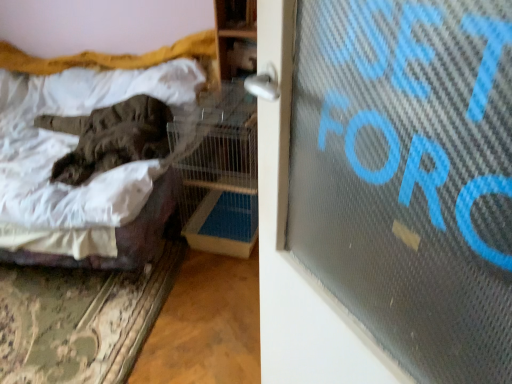
Image resolution: width=512 pixels, height=384 pixels. What do you see at coordinates (110, 137) in the screenshot?
I see `dark gray fur cat at left` at bounding box center [110, 137].

Locate an element on the screen. dark gray fur cat at left is located at coordinates (110, 137).

What is the approximate height of velvet brown blanket at left?

The height of velvet brown blanket at left is 24.88 inches.

What do you see at coordinates (118, 58) in the screenshot? The image size is (512, 384). I see `velvet brown blanket at left` at bounding box center [118, 58].

Image resolution: width=512 pixels, height=384 pixels. I want to click on velvet brown blanket at left, so click(x=118, y=58).

In order to face velvet brown blanket at left, should I rotate leftwards or rightwards?

To face it directly, rotate left by 27.102 degrees.

The height and width of the screenshot is (384, 512). I want to click on dark gray fur cat at left, so click(110, 137).

Can you confirm if dark gray fur cat at left is positioned to the right of velvet brown blanket at left?

Yes, dark gray fur cat at left is to the right of velvet brown blanket at left.

Is the position of dark gray fur cat at left less distant than that of velvet brown blanket at left?

No, dark gray fur cat at left is further to the viewer.

Is point (122, 125) positioned after point (15, 55)?

No, (122, 125) is in front of (15, 55).

From the image's perspective, would you say dark gray fur cat at left is shown under velvet brown blanket at left?

No, from the image's perspective, dark gray fur cat at left is not beneath velvet brown blanket at left.

From a real-world perspective, is dark gray fur cat at left physically located above or below velvet brown blanket at left?

In terms of real-world spatial position, dark gray fur cat at left is above velvet brown blanket at left.

Is dark gray fur cat at left wider than velvet brown blanket at left?

No.

Considering the relative sizes of dark gray fur cat at left and velvet brown blanket at left in the image provided, is dark gray fur cat at left taller than velvet brown blanket at left?

No.

Does dark gray fur cat at left have a larger size compared to velvet brown blanket at left?

Incorrect, dark gray fur cat at left is not larger than velvet brown blanket at left.

Is dark gray fur cat at left outside of velvet brown blanket at left?

That's incorrect, dark gray fur cat at left is not completely outside velvet brown blanket at left.

Is dark gray fur cat at left next to velvet brown blanket at left and touching it?

dark gray fur cat at left and velvet brown blanket at left are not in contact.

Is dark gray fur cat at left positioned with its back to velvet brown blanket at left?

Yes, dark gray fur cat at left is facing away from velvet brown blanket at left.

At what (x,y) coordinates should I click in order to perform the action: click on animal above the velvet brown blanket at left (from the image's perspective). Please return your answer as a coordinate pair (x, y). This screenshot has height=384, width=512. Looking at the image, I should click on (110, 137).

Can you confirm if velvet brown blanket at left is positioned to the right of dark gray fur cat at left?

In fact, velvet brown blanket at left is to the left of dark gray fur cat at left.

Which object is further away from the camera taking this photo, velvet brown blanket at left or dark gray fur cat at left?

dark gray fur cat at left is further away from the camera.

Which point is more forward, (123,59) or (168,153)?

The point (168,153) is closer to the camera.

From the image's perspective, between velvet brown blanket at left and dark gray fur cat at left, which one is located above?

dark gray fur cat at left is shown above in the image.

From a real-world perspective, which is physically above, velvet brown blanket at left or dark gray fur cat at left?

dark gray fur cat at left is physically above.

Which of these two, velvet brown blanket at left or dark gray fur cat at left, is thinner?

With smaller width is dark gray fur cat at left.

Which of these two, velvet brown blanket at left or dark gray fur cat at left, stands taller?

velvet brown blanket at left is taller.

Between velvet brown blanket at left and dark gray fur cat at left, which one has smaller size?

dark gray fur cat at left.

Can we say velvet brown blanket at left lies outside dark gray fur cat at left?

That's correct, velvet brown blanket at left is outside of dark gray fur cat at left.

Is velvet brown blanket at left touching dark gray fur cat at left?

No, velvet brown blanket at left is not touching dark gray fur cat at left.

Could you tell me if velvet brown blanket at left is turned towards dark gray fur cat at left?

Yes.

You are a GUI agent. You are given a task and a screenshot of the screen. Output one action in this format:
    pyautogui.click(x=<x>, y=<y>)
    Task: Click on the bed below the dark gray fur cat at left (from a real-world perspective)
    
    Given the screenshot: What is the action you would take?
    pyautogui.click(x=118, y=58)

Image resolution: width=512 pixels, height=384 pixels. What are the coordinates of `bed below the dark gray fur cat at left (from a real-world perspective)` in the screenshot? It's located at (118, 58).

This screenshot has height=384, width=512. What are the coordinates of `animal located behind the velvet brown blanket at left` in the screenshot? It's located at (110, 137).